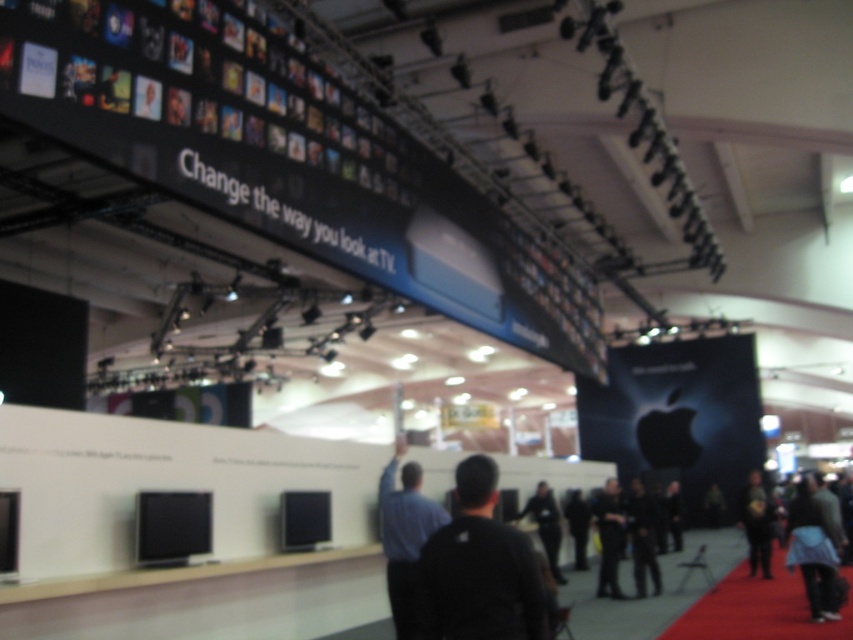
Question: Which of these objects is positioned closest to the dark gray fabric jacket at lower right?

Choices:
 (A) dark gray fabric pants at lower right
 (B) blue shirt at center
 (C) dark gray sweater at lower right
 (D) black leather jacket at lower right

Answer: (D)

Question: Is black leather jacket at center to the left of dark gray sweater at lower right from the viewer's perspective?

Choices:
 (A) no
 (B) yes

Answer: (B)

Question: In this image, where is dark gray fabric jacket at lower right located relative to black leather jacket at lower right?

Choices:
 (A) left
 (B) right

Answer: (B)

Question: Which point appears closest to the camera in this image?

Choices:
 (A) (643, 566)
 (B) (602, 496)

Answer: (A)

Question: Can you confirm if black leather jacket at center is wider than dark gray fabric pants at lower right?

Choices:
 (A) yes
 (B) no

Answer: (B)

Question: Which point is closer to the camera taking this photo?

Choices:
 (A) (409, 596)
 (B) (596, 589)
 (C) (640, 497)

Answer: (A)